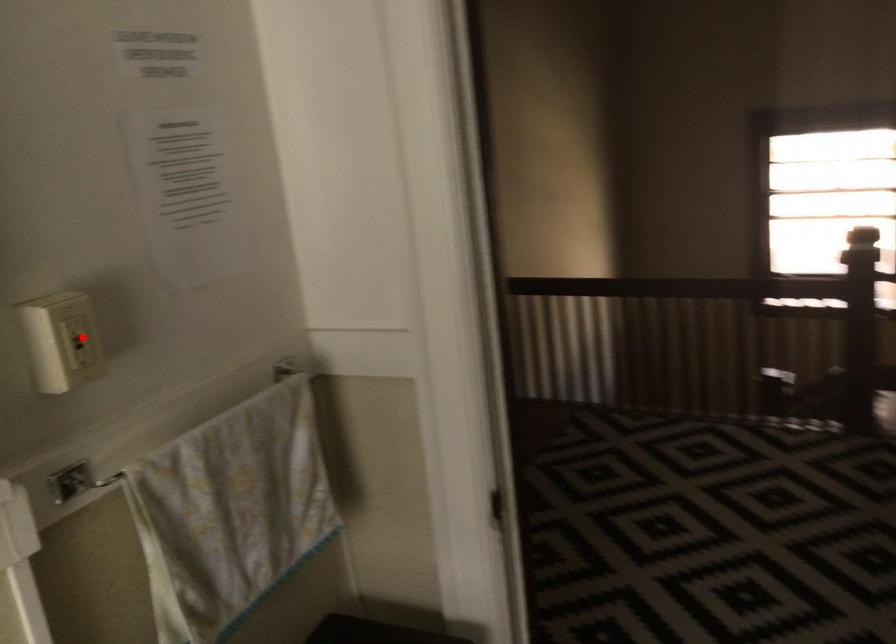
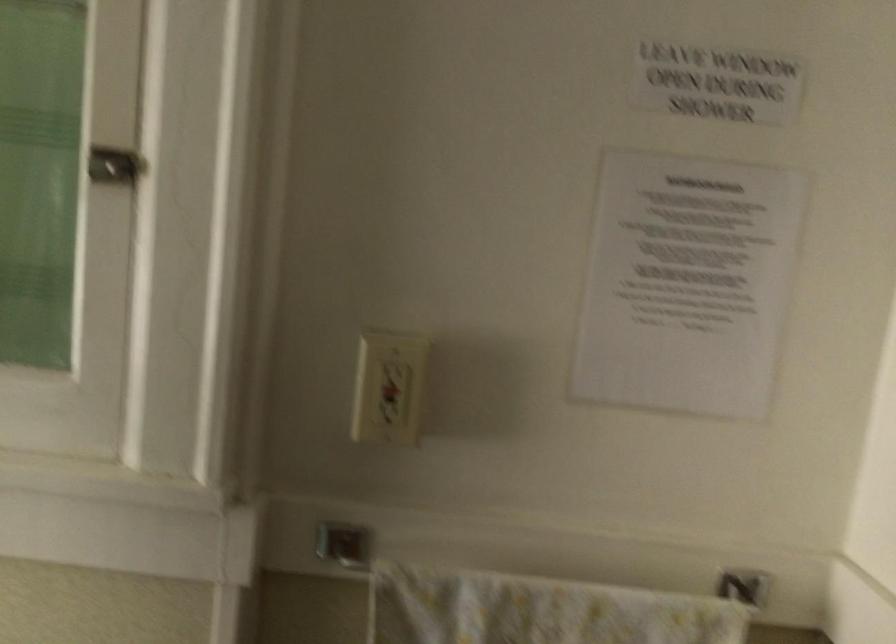
In the second image, find the point that corresponds to the highlighted location in the first image.

(389, 388)